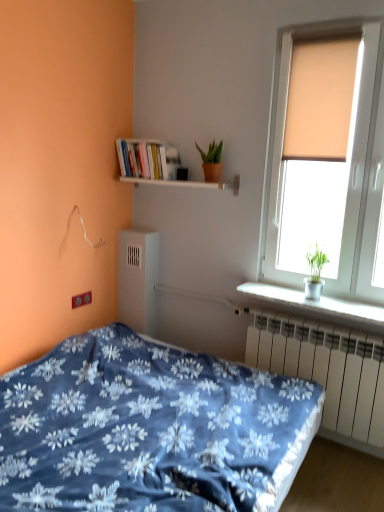
Question: Visually, is white metallic radiator at lower right positioned to the left or to the right of beige fabric curtain at upper right?

Choices:
 (A) right
 (B) left

Answer: (A)

Question: From the image's perspective, is white metallic radiator at lower right positioned above or below beige fabric curtain at upper right?

Choices:
 (A) below
 (B) above

Answer: (A)

Question: Which object is positioned closest to the blue floral fabric bed at lower left?

Choices:
 (A) matte orange pot at upper center
 (B) beige fabric curtain at upper right
 (C) white plastic pot at right, which is counted as the 1th window sill, starting from the right
 (D) hardcover books at upper left
 (E) white wooden shelf at upper center, arranged as the 2th window sill when ordered from the bottom

Answer: (C)

Question: Estimate the real-world distances between objects in this image. Which object is closer to the matte orange pot at upper center?

Choices:
 (A) matte beige window at upper right
 (B) hardcover books at upper left
 (C) white metallic radiator at lower right
 (D) beige fabric curtain at upper right
 (E) white plastic pot at right, which is counted as the 1th window sill, starting from the right

Answer: (B)